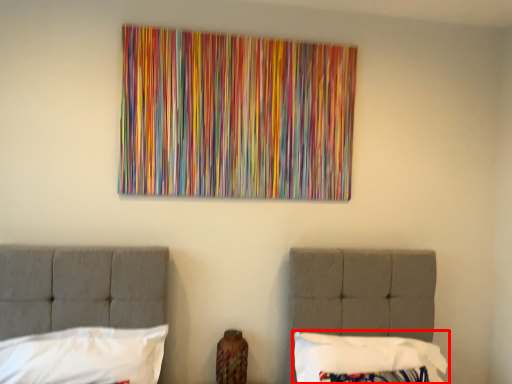
Question: Observing the image, what is the correct spatial positioning of pillow (annotated by the red box) in reference to pillow?

Choices:
 (A) left
 (B) right

Answer: (B)